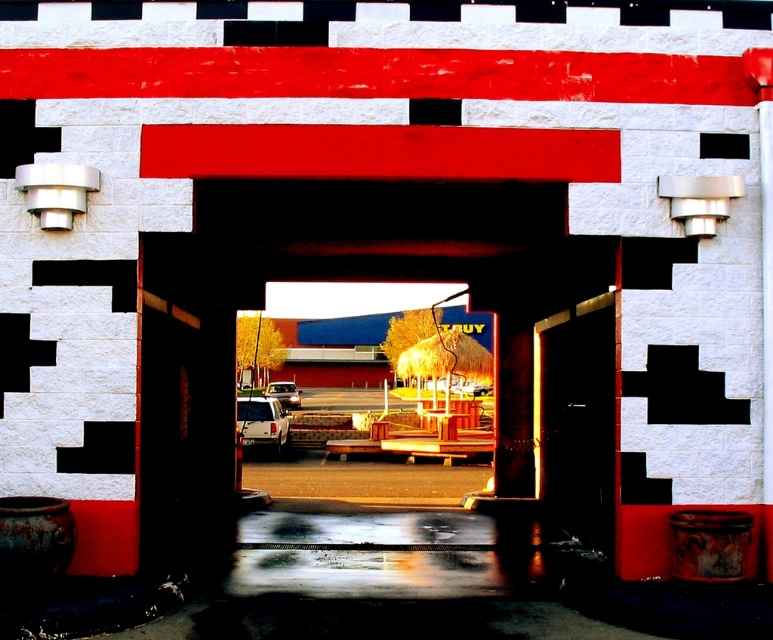
Is point (603, 433) behind point (295, 396)?

No, it is not.

Can you confirm if wooden door at center is positioned above metallic silver car at center?

Yes.

Measure the distance between wooden door at center and camera.

wooden door at center is 35.13 feet away from camera.

At what (x,y) coordinates should I click in order to perform the action: click on wooden door at center. Please return your answer as a coordinate pair (x, y). Image resolution: width=773 pixels, height=640 pixels. Looking at the image, I should click on (577, 417).

Can you confirm if wooden door at center is positioned to the left of metallic silver suv at center?

No, wooden door at center is not to the left of metallic silver suv at center.

Does wooden door at center have a larger size compared to metallic silver suv at center?

Actually, wooden door at center might be smaller than metallic silver suv at center.

Does point (554, 518) lie in front of point (278, 417)?

That is True.

This screenshot has width=773, height=640. In order to click on wooden door at center in this screenshot , I will do `click(577, 417)`.

Does wooden door at center have a greater width compared to black rubber tire at center?

No.

Can you confirm if wooden door at center is smaller than black rubber tire at center?

Incorrect, wooden door at center is not smaller in size than black rubber tire at center.

Between point (583, 419) and point (283, 442), which one is positioned in front?

Point (583, 419) is more forward.

At what (x,y) coordinates should I click in order to perform the action: click on wooden door at center. Please return your answer as a coordinate pair (x, y). Looking at the image, I should click on (577, 417).